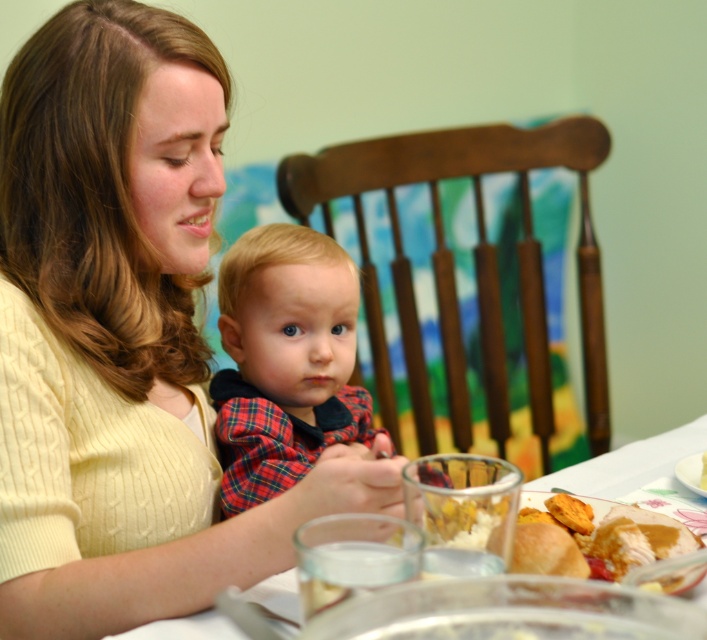
You are a person sitting at the dining table in the image. You want to reach for an object located at point (42, 584) and another at point (547, 486). Which point is closer to you?

Point (42, 584) is in front of point (547, 486), so it is closer to you.

You are a fashion designer observing the scene. You need to determine which clothing item has a bigger size between the matte yellow sweater at center and the plaid fabric shirt at center. Which one is larger?

The matte yellow sweater at center is larger in size than the plaid fabric shirt at center.